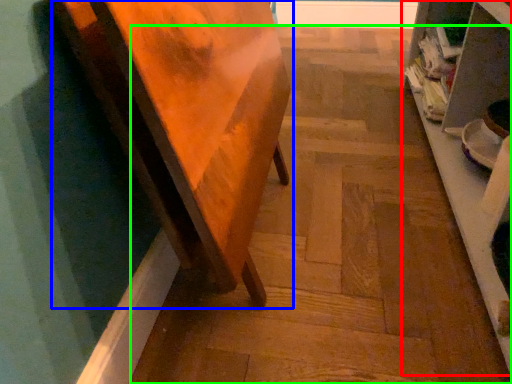
Question: Which object is the farthest from shelf (highlighted by a red box)? Choose among these: furniture (highlighted by a blue box) or stair (highlighted by a green box).

Choices:
 (A) furniture
 (B) stair

Answer: (A)